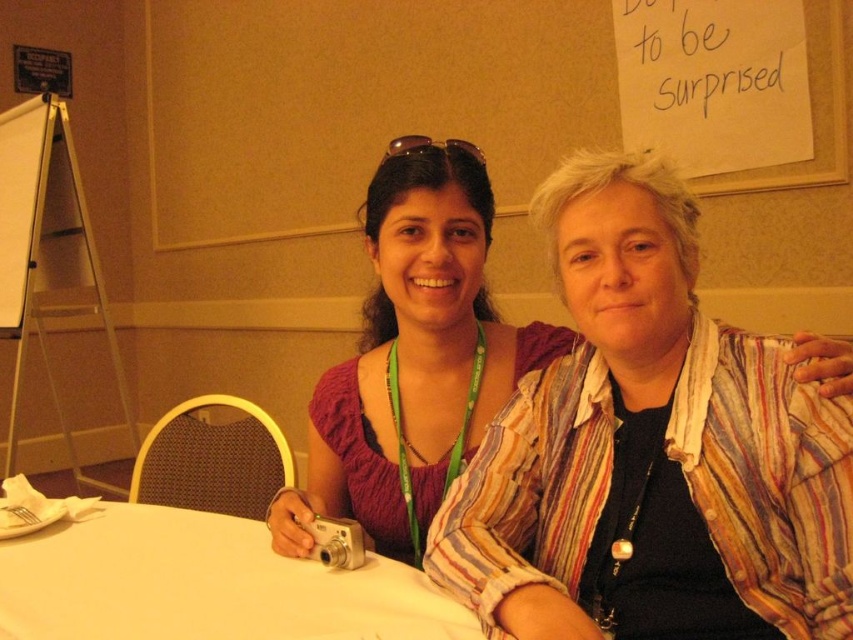
Question: Is matte purple blouse at center bigger than white matte table at center?

Choices:
 (A) no
 (B) yes

Answer: (B)

Question: From the image, what is the correct spatial relationship of matte purple blouse at center in relation to whiteboard at left?

Choices:
 (A) below
 (B) above

Answer: (A)

Question: Based on their relative distances, which object is farther from the white matte table at center?

Choices:
 (A) matte purple blouse at center
 (B) whiteboard at left

Answer: (B)

Question: Among these points, which one is nearest to the camera?

Choices:
 (A) (134, 532)
 (B) (64, 115)

Answer: (A)

Question: Is matte purple blouse at center further to camera compared to whiteboard at left?

Choices:
 (A) yes
 (B) no

Answer: (B)

Question: Which object is the farthest from the white matte table at center?

Choices:
 (A) matte purple blouse at center
 (B) whiteboard at left

Answer: (B)